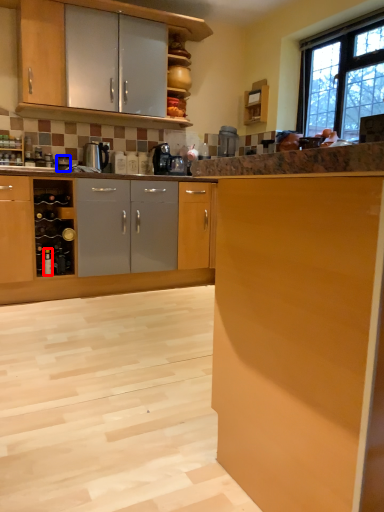
Question: Which of the following is the farthest to the observer, bottle (highlighted by a red box) or appliance (highlighted by a blue box)?

Choices:
 (A) bottle
 (B) appliance

Answer: (B)